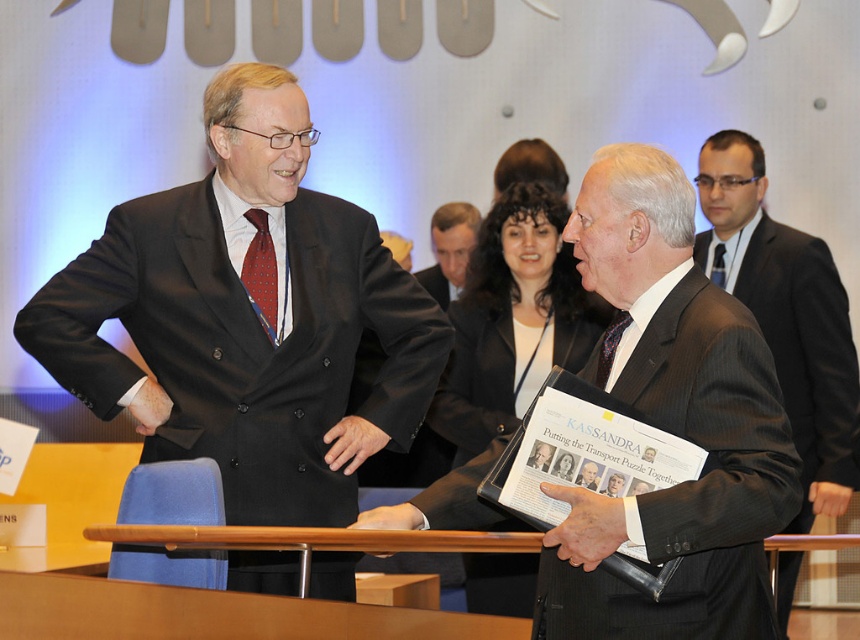
You are a photographer at the event and need to capture a closeup of both the black leather hand at center and the leather textured hand at center. Since your camera can only focus on one hand at a time, which hand should you focus on first to ensure the wider hand is in focus?

The black leather hand at center has a larger width than the leather textured hand at center, so you should focus on the black leather hand at center first to ensure the wider hand is in focus.

You are organizing a charity event and need to ensure that all items fit on a display table. The table has limited space. Given the black suit at left and the dark blue textured tie at center, which item takes up more space?

The black suit at left is bigger than the dark blue textured tie at center, so it takes up more space on the display table.

You are standing at the center of the image. Which direction should you move to get closer to the black suit at left?

The black suit at left is positioned at point 0.492 on the x and 0.286 on the y axis. Since you are at the center, moving to the left would bring you closer to the black suit at left.